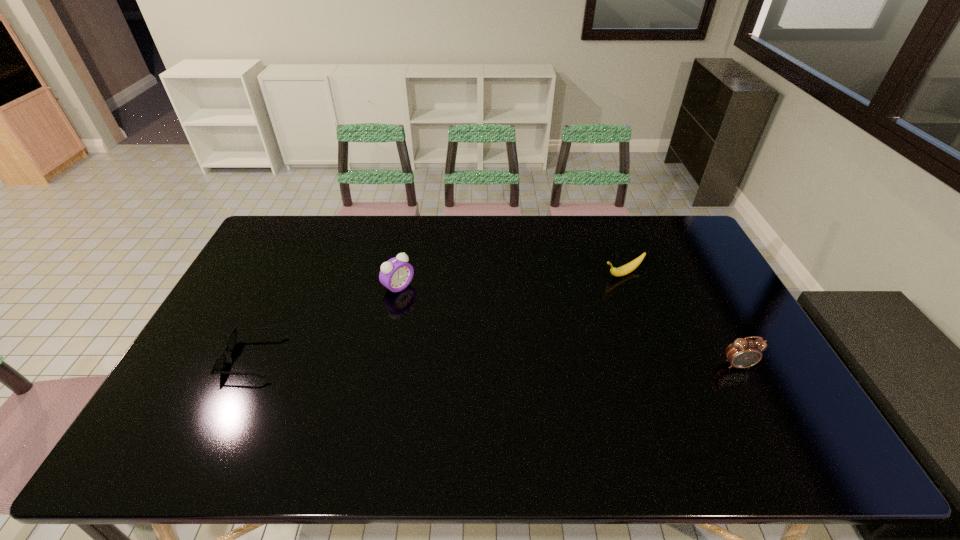
This screenshot has width=960, height=540. What are the coordinates of `vacant space on the desktop that is between the leftmost object and the nearer alarm clock and is positioned at the stem of the second object from right to left` in the screenshot? It's located at (440, 360).

Where is `vacant space on the desktop that is between the sunglasses and the right alarm clock and is positioned on the face of the second object from left to right`? The image size is (960, 540). vacant space on the desktop that is between the sunglasses and the right alarm clock and is positioned on the face of the second object from left to right is located at coordinates (500, 361).